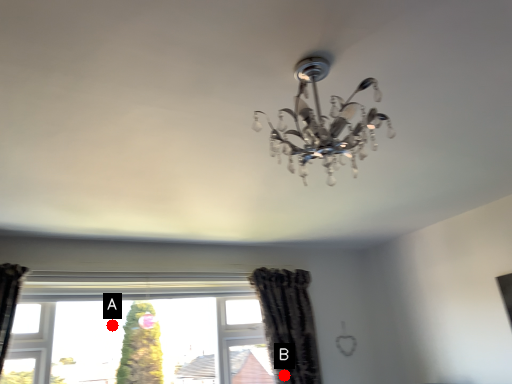
Question: Two points are circled on the image, labeled by A and B beside each circle. Which point is farther to the camera?

Choices:
 (A) A is further
 (B) B is further

Answer: (A)